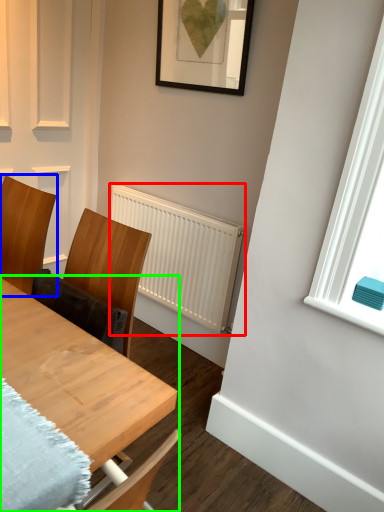
Question: Based on their relative distances, which object is farther from radiator (highlighted by a red box)? Choose from chair (highlighted by a blue box) and table (highlighted by a green box).

Choices:
 (A) chair
 (B) table

Answer: (B)